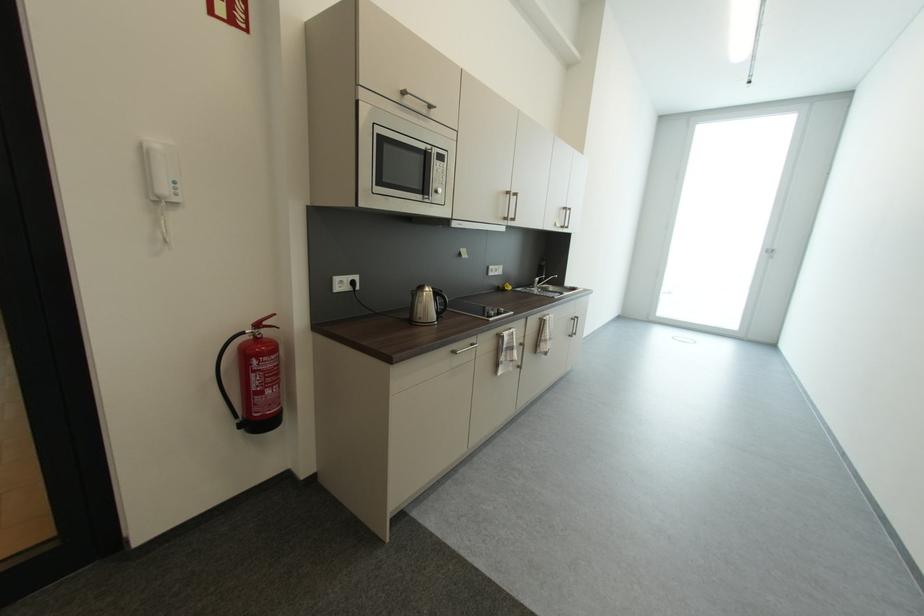
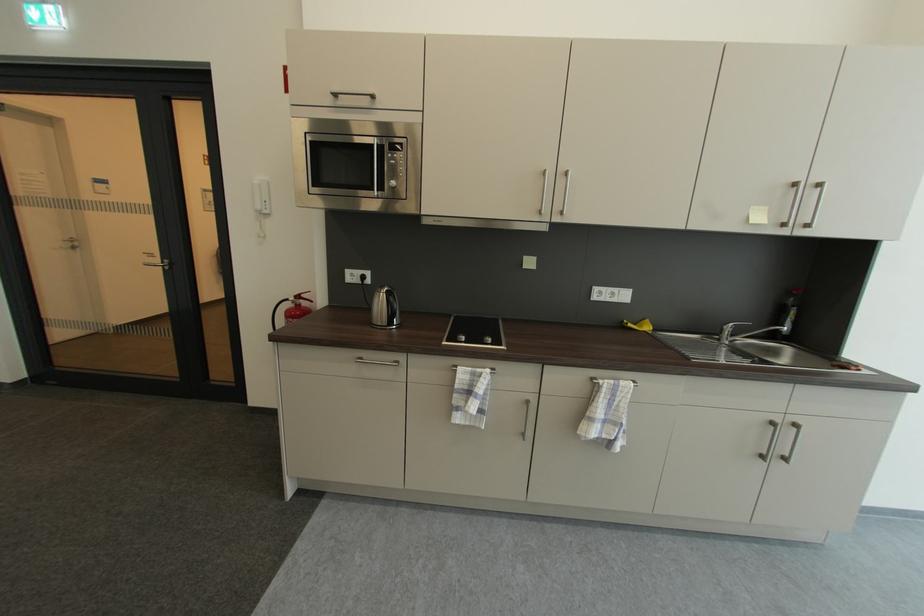
Find the pixel in the second image that matches (x=171, y=192) in the first image.

(264, 208)